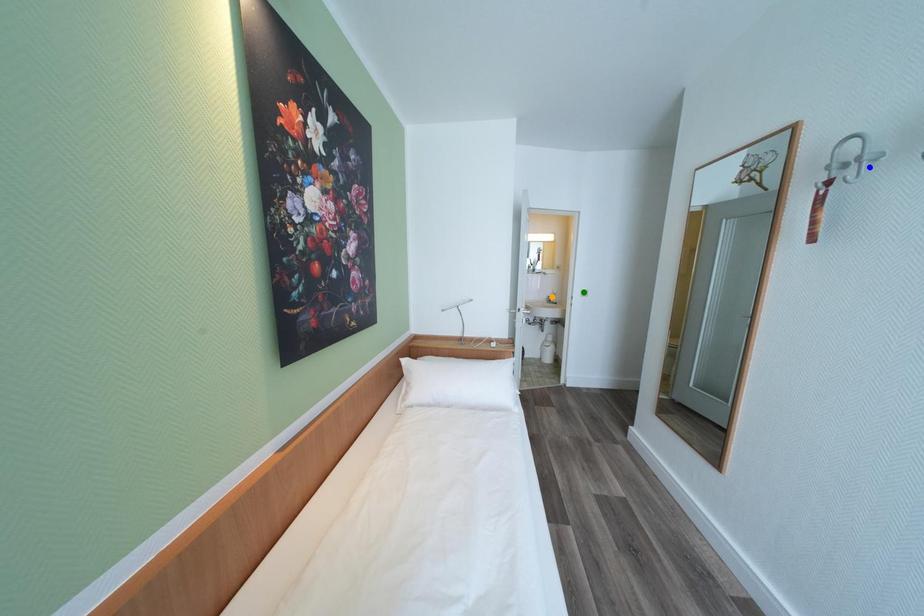
Order these from farthest to nearest:
orange point
green point
blue point

green point, orange point, blue point